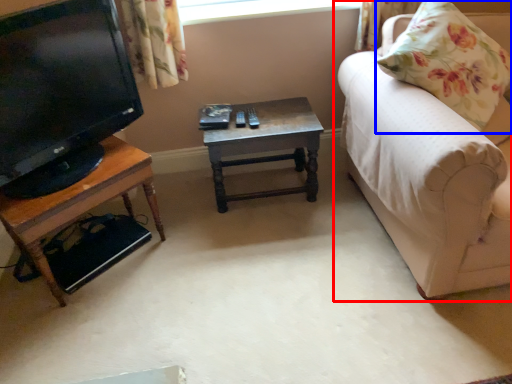
Question: Which point is further to the camera, studio couch (highlighted by a red box) or pillow (highlighted by a blue box)?

Choices:
 (A) studio couch
 (B) pillow

Answer: (B)